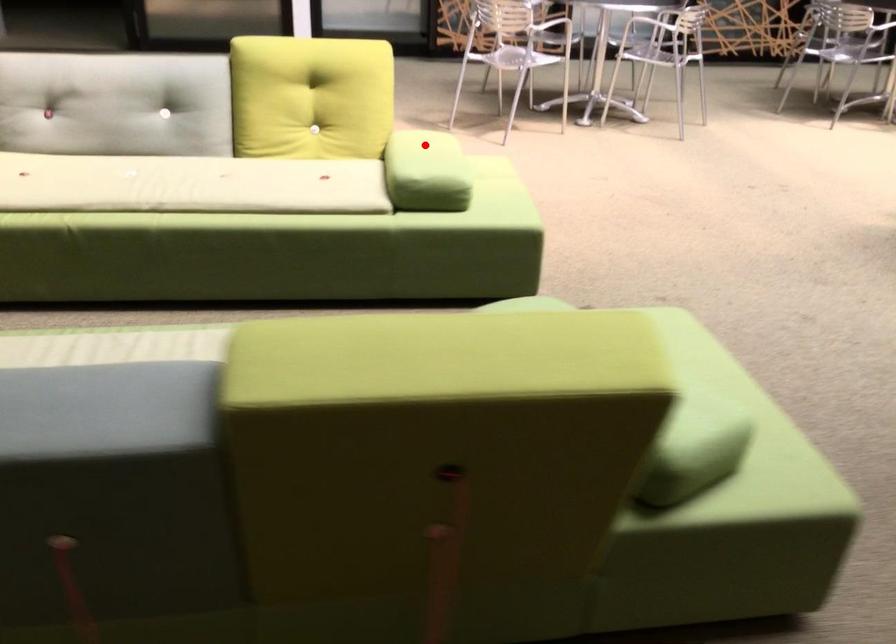
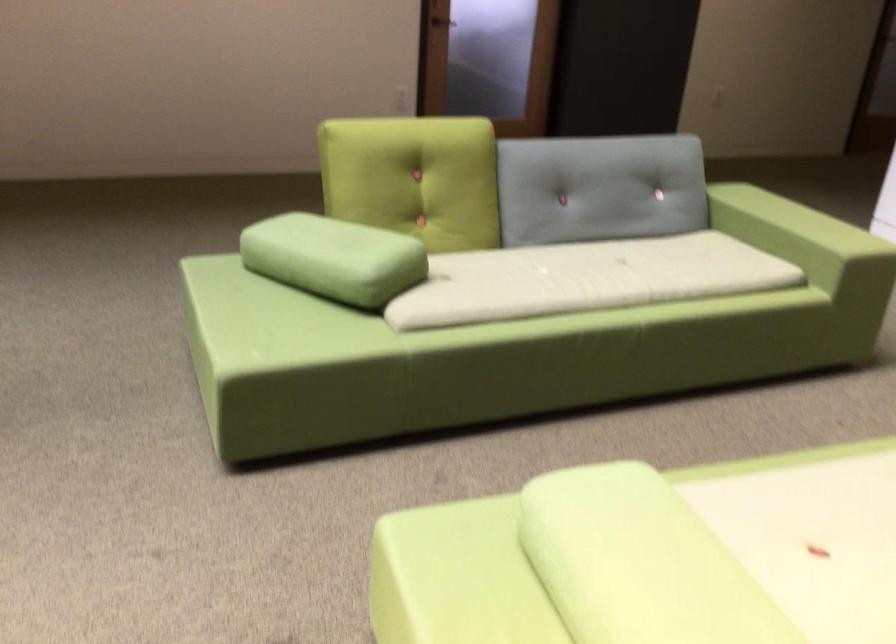
Question: I am providing you with two images of the same scene from different viewpoints. Given a red point in image1, look at the same physical point in image2. Is it:

Choices:
 (A) Closer to the viewpoint
 (B) Farther from the viewpoint

Answer: (A)